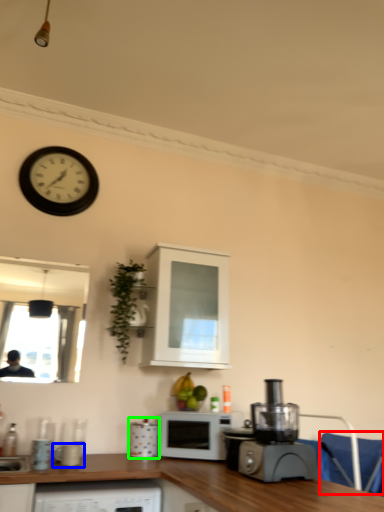
Question: Estimate the real-world distances between objects in this image. Which object is farther from armchair (highlighted by a red box), appliance (highlighted by a blue box) or appliance (highlighted by a green box)?

Choices:
 (A) appliance
 (B) appliance

Answer: (A)